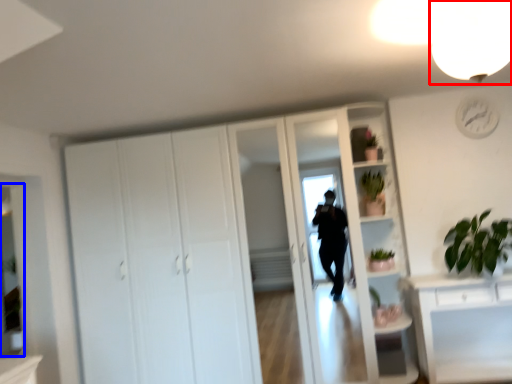
Question: Among these objects, which one is nearest to the camera, light fixture (highlighted by a red box) or mirror (highlighted by a blue box)?

Choices:
 (A) light fixture
 (B) mirror

Answer: (A)